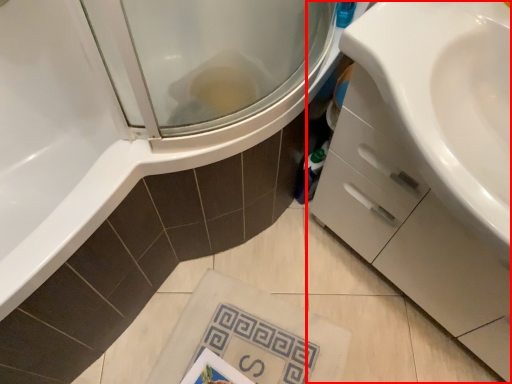
Question: From the image's perspective, where is bathroom cabinet (annotated by the red box) located in relation to beach towel in the image?

Choices:
 (A) below
 (B) above

Answer: (B)